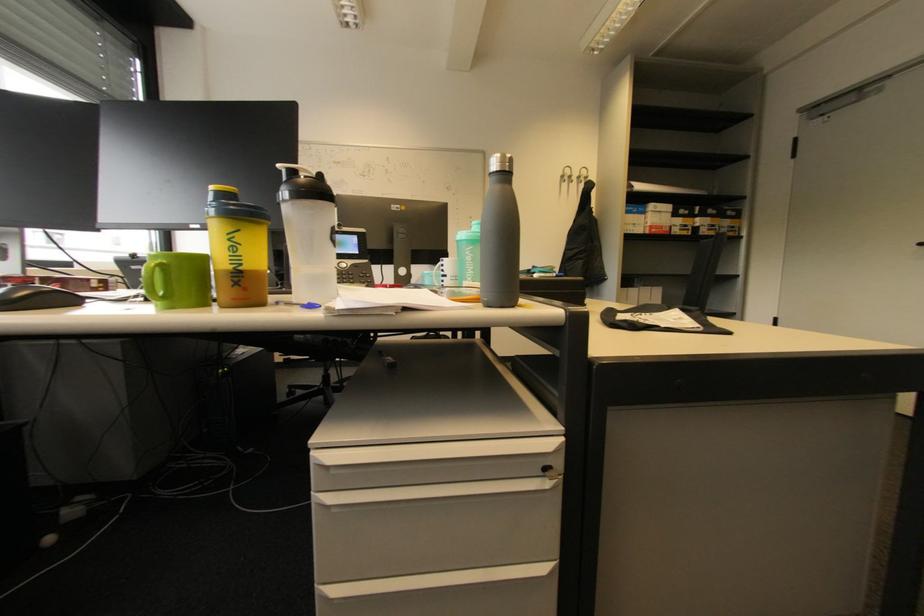
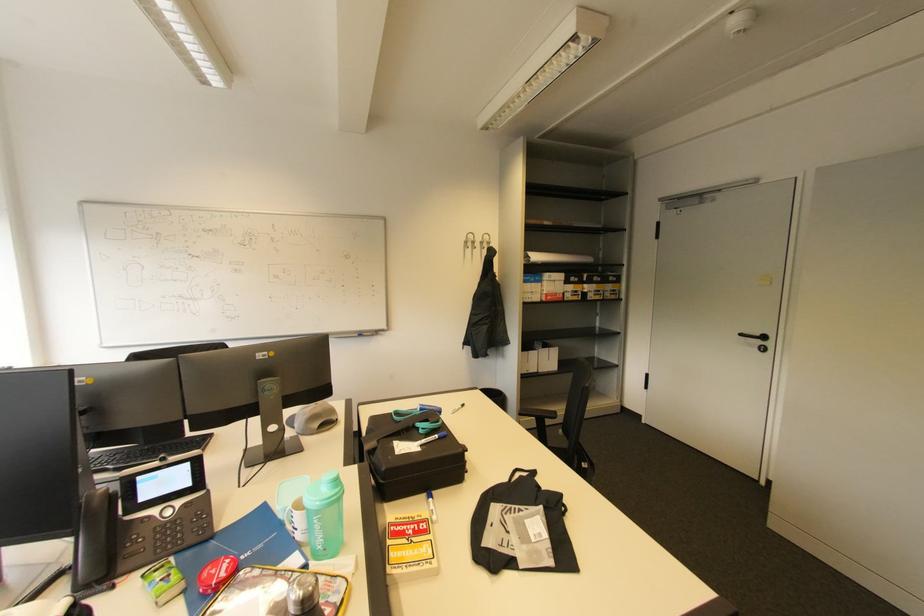
Locate, in the second image, the point that corresponds to (x=567, y=177) in the first image.

(470, 243)